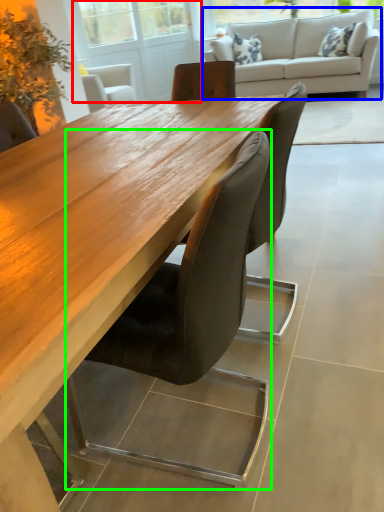
Question: Which is farther away from screen door (highlighted by a red box)? studio couch (highlighted by a blue box) or chair (highlighted by a green box)?

Choices:
 (A) studio couch
 (B) chair

Answer: (B)